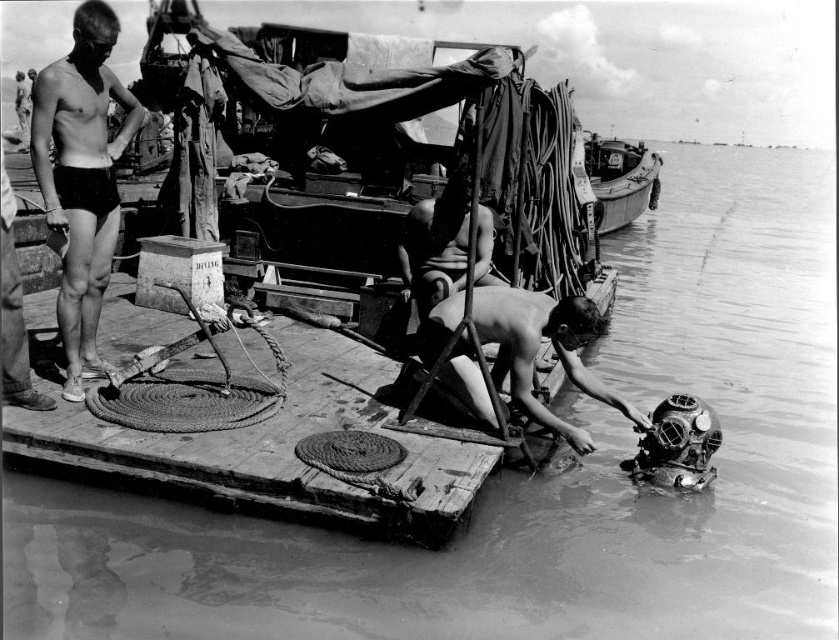
Question: Can you confirm if smooth skin diver at lower center is positioned below smooth skin man at center?

Choices:
 (A) no
 (B) yes

Answer: (B)

Question: Which point is closer to the camera taking this photo?

Choices:
 (A) (301, 472)
 (B) (584, 384)
 (C) (86, 45)
 (D) (481, 236)

Answer: (A)

Question: Considering the real-world distances, which object is closest to the wooden dock at lower center?

Choices:
 (A) smooth skin man at center
 (B) smooth skin diver at lower center

Answer: (B)

Question: Can you confirm if black matte shorts at left is bigger than wooden boat at upper right?

Choices:
 (A) no
 (B) yes

Answer: (A)

Question: Can you confirm if wooden dock at lower center is smaller than smooth skin diver at lower center?

Choices:
 (A) yes
 (B) no

Answer: (B)

Question: Among these objects, which one is farthest from the camera?

Choices:
 (A) smooth skin man at center
 (B) smooth skin diver at lower center
 (C) black matte shorts at left
 (D) wooden dock at lower center

Answer: (A)